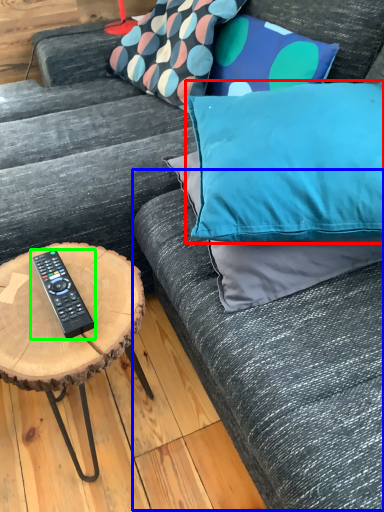
Question: Which is farther away from pillow (highlighted by a red box)? couch (highlighted by a blue box) or remote control (highlighted by a green box)?

Choices:
 (A) couch
 (B) remote control

Answer: (B)